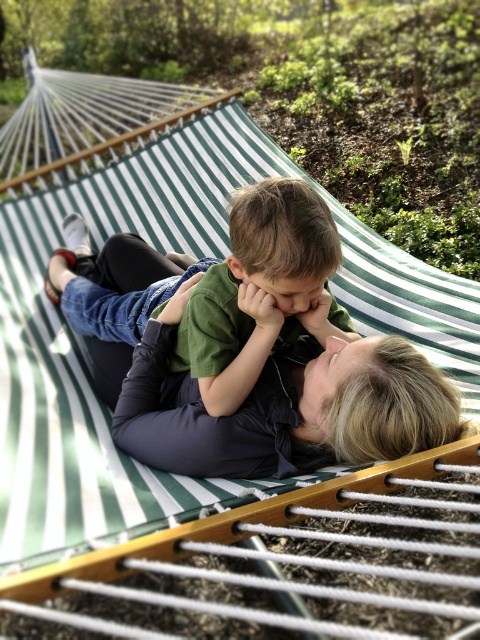
Is matte black pants at center below green matte shirt at center?

Yes, matte black pants at center is below green matte shirt at center.

Consider the image. Is matte black pants at center to the right of green matte shirt at center from the viewer's perspective?

Yes, matte black pants at center is to the right of green matte shirt at center.

Identify the location of matte black pants at center. This screenshot has height=640, width=480. tap(287, 410).

The image size is (480, 640). I want to click on matte black pants at center, so pyautogui.click(x=287, y=410).